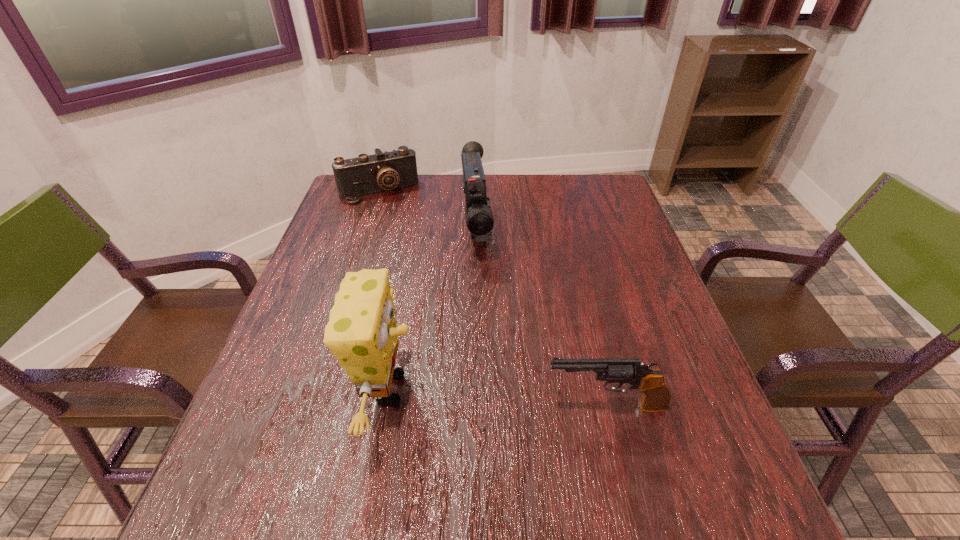
Find the location of a particular element. The height and width of the screenshot is (540, 960). vacant space located on the front-facing side of the second object from right to left is located at coordinates (484, 298).

At what (x,y) coordinates should I click in order to perform the action: click on vacant position located on the front-facing side of the second object from right to left. Please return your answer as a coordinate pair (x, y). The width and height of the screenshot is (960, 540). Looking at the image, I should click on (484, 298).

Where is `vacant space located 0.400m on the front-facing side of the shortest object`? The height and width of the screenshot is (540, 960). vacant space located 0.400m on the front-facing side of the shortest object is located at coordinates (427, 285).

You are a GUI agent. You are given a task and a screenshot of the screen. Output one action in this format:
    pyautogui.click(x=<x>, y=<y>)
    Task: Click on the free point located on the front-facing side of the shortest object
    This screenshot has height=540, width=960.
    Given the screenshot: What is the action you would take?
    click(x=417, y=264)

Where is `vacant area situated on the front-facing side of the shortest object`? vacant area situated on the front-facing side of the shortest object is located at coordinates (413, 255).

The image size is (960, 540). In order to click on camcorder that is at the far edge in this screenshot , I will do `click(479, 218)`.

The width and height of the screenshot is (960, 540). What are the coordinates of `camera situated at the far edge` in the screenshot? It's located at (367, 174).

I want to click on object that is at the near edge, so click(x=361, y=332).

Find the location of a particular element. This screenshot has width=960, height=540. object that is positioned at the left edge is located at coordinates (367, 174).

Find the location of a particular element. object that is at the right edge is located at coordinates (656, 396).